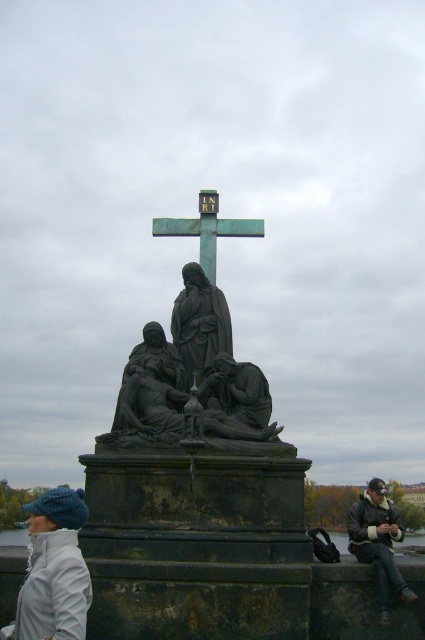
In the scene shown: Is bronze statue at center thinner than green patinated metal cross at center?

No, bronze statue at center is not thinner than green patinated metal cross at center.

Describe the element at coordinates (193, 451) in the screenshot. Image resolution: width=425 pixels, height=640 pixels. I see `bronze statue at center` at that location.

Which is behind, point (223, 458) or point (260, 230)?

The point (260, 230) is behind.

Find the location of a particular element. The height and width of the screenshot is (640, 425). bronze statue at center is located at coordinates (193, 451).

Who is shorter, dark gray stone statue at center or dark brown leather jacket at lower right?

With less height is dark brown leather jacket at lower right.

Image resolution: width=425 pixels, height=640 pixels. Identify the location of dark gray stone statue at center. (200, 323).

Locate an element on the screen. dark gray stone statue at center is located at coordinates (200, 323).

Does bronze statue at center have a smaller size compared to dark brown leather jacket at lower right?

Actually, bronze statue at center might be larger than dark brown leather jacket at lower right.

Can you confirm if bronze statue at center is wider than dark brown leather jacket at lower right?

Correct, the width of bronze statue at center exceeds that of dark brown leather jacket at lower right.

Describe the element at coordinates (193, 451) in the screenshot. I see `bronze statue at center` at that location.

Identify the location of bronze statue at center. The height and width of the screenshot is (640, 425). (193, 451).